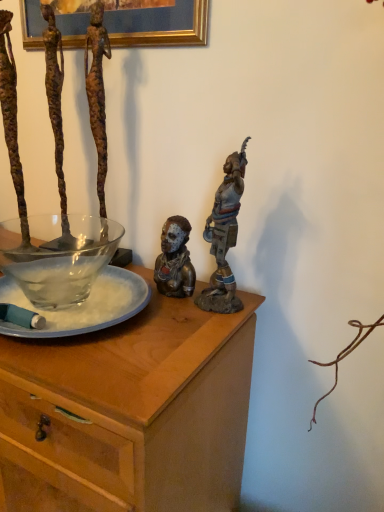
Question: From the image's perspective, is rusty metal figure at upper left, acting as the first person starting from the left, on top of clear glass plate at center?

Choices:
 (A) yes
 (B) no

Answer: (A)

Question: Can you confirm if rusty metal figure at upper left, acting as the first person starting from the left, is shorter than clear glass plate at center?

Choices:
 (A) yes
 (B) no

Answer: (B)

Question: Is rusty metal figure at upper left, acting as the first person starting from the left, oriented towards clear glass plate at center?

Choices:
 (A) no
 (B) yes

Answer: (A)

Question: Is rusty metal figure at upper left, placed as the third person when sorted from right to left, facing away from clear glass plate at center?

Choices:
 (A) no
 (B) yes

Answer: (A)

Question: Is rusty metal figure at upper left, placed as the third person when sorted from right to left, thinner than clear glass plate at center?

Choices:
 (A) no
 (B) yes

Answer: (B)

Question: Is rusty metal figure at upper left, placed as the third person when sorted from right to left, completely or partially outside of clear glass plate at center?

Choices:
 (A) yes
 (B) no

Answer: (A)

Question: From the image's perspective, is bronze statue at center, placed as the 2th person when sorted from left to right, above bronze statue at upper right, which is counted as the 3th person, starting from the left?

Choices:
 (A) yes
 (B) no

Answer: (B)

Question: Is there a large distance between bronze statue at center, placed as the 2th person when sorted from left to right, and bronze statue at upper right, the first person in the right-to-left sequence?

Choices:
 (A) yes
 (B) no

Answer: (B)

Question: Is the depth of bronze statue at center, placed as the 2th person when sorted from left to right, less than that of bronze statue at upper right, which is counted as the 3th person, starting from the left?

Choices:
 (A) yes
 (B) no

Answer: (B)

Question: Can you confirm if bronze statue at center, the 2th person in the right-to-left sequence, is bigger than bronze statue at upper right, which is counted as the 3th person, starting from the left?

Choices:
 (A) no
 (B) yes

Answer: (A)

Question: From a real-world perspective, is bronze statue at center, the 2th person in the right-to-left sequence, located higher than bronze statue at upper right, which is counted as the 3th person, starting from the left?

Choices:
 (A) no
 (B) yes

Answer: (A)

Question: Does bronze statue at center, placed as the 2th person when sorted from left to right, appear on the left side of bronze statue at upper right, the first person in the right-to-left sequence?

Choices:
 (A) yes
 (B) no

Answer: (A)

Question: From a real-world perspective, does rusty metal figure at upper left, acting as the first person starting from the left, sit lower than bronze statue at center, the 2th person in the right-to-left sequence?

Choices:
 (A) yes
 (B) no

Answer: (B)